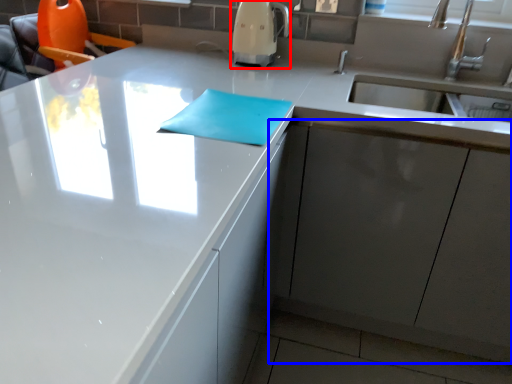
Question: Which point is closer to the camera, coffee machine (highlighted by a red box) or cabinetry (highlighted by a blue box)?

Choices:
 (A) coffee machine
 (B) cabinetry

Answer: (B)